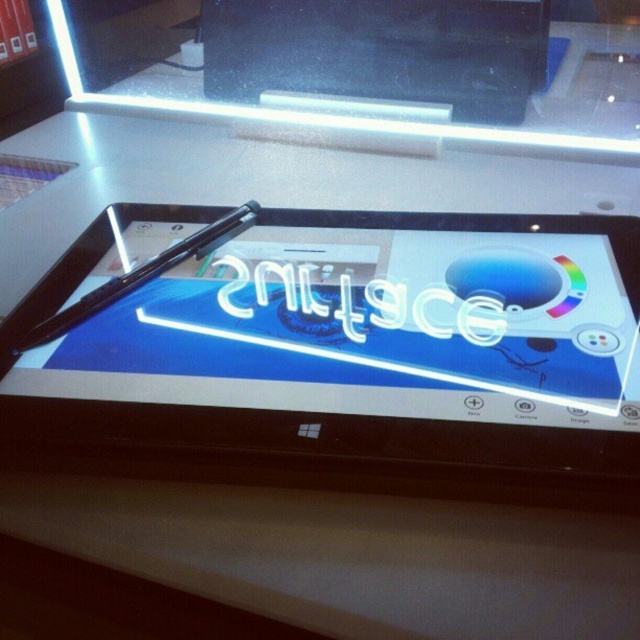
You are setting up a product display for a tech store. You have a matte black tablet at center and a matte black laptop at upper center. According to the image, where should you place the tablet and laptop to match the scene?

Place the matte black tablet at center below the matte black laptop at upper center to match the scene.

You are setting up a product display for a tech store. The display requires placing a matte black laptop at upper center and a black glossy pen at center so that they are exactly 24 inches apart. Based on the current arrangement shown in the image, do you need to move the objects closer together or farther apart to meet the requirement?

The current distance between the matte black laptop at upper center and the black glossy pen at center is 20.78 inches. To reach the required 24 inches, you need to move them farther apart.

You are setting up a display for a tech store and need to ensure the matte black tablet at center and the black glossy pen at center are visible to customers. Given their sizes, which object should you place closer to the front of the display to ensure both are easily seen?

The matte black tablet at center is larger than the black glossy pen at center, so placing the smaller pen closer to the front of the display will ensure both objects are easily visible without one blocking the other.